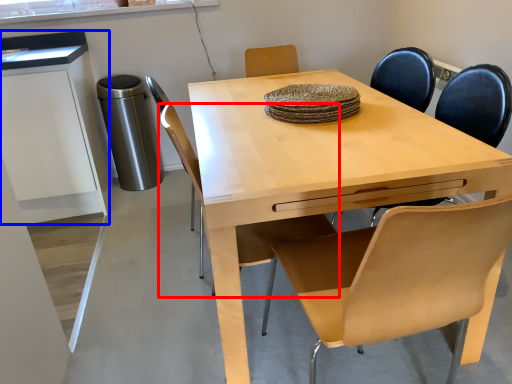
Question: Which of the following is the closest to the observer, chair (highlighted by a red box) or cabinetry (highlighted by a blue box)?

Choices:
 (A) chair
 (B) cabinetry

Answer: (A)